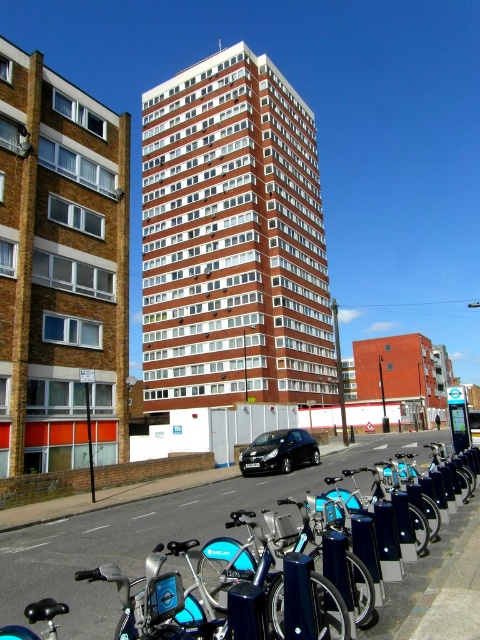
Does metallic gray bike rack at lower center have a larger size compared to black metallic car at center?

Indeed, metallic gray bike rack at lower center has a larger size compared to black metallic car at center.

Is metallic gray bike rack at lower center below black metallic car at center?

Actually, metallic gray bike rack at lower center is above black metallic car at center.

Which is in front, point (157, 512) or point (307, 438)?

Point (157, 512) is more forward.

Identify the location of metallic gray bike rack at lower center. The width and height of the screenshot is (480, 640). (153, 536).